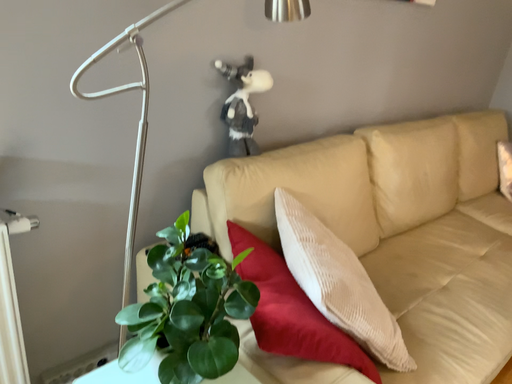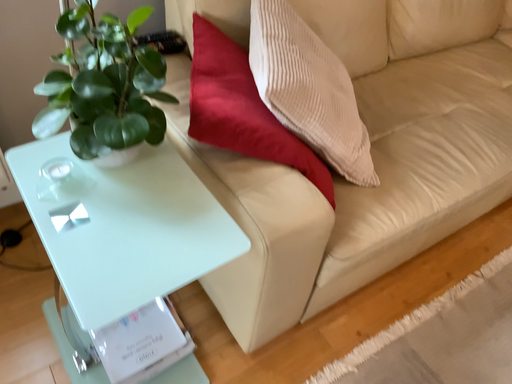
Question: Which way did the camera rotate in the video?

Choices:
 (A) rotated downward
 (B) rotated upward

Answer: (A)